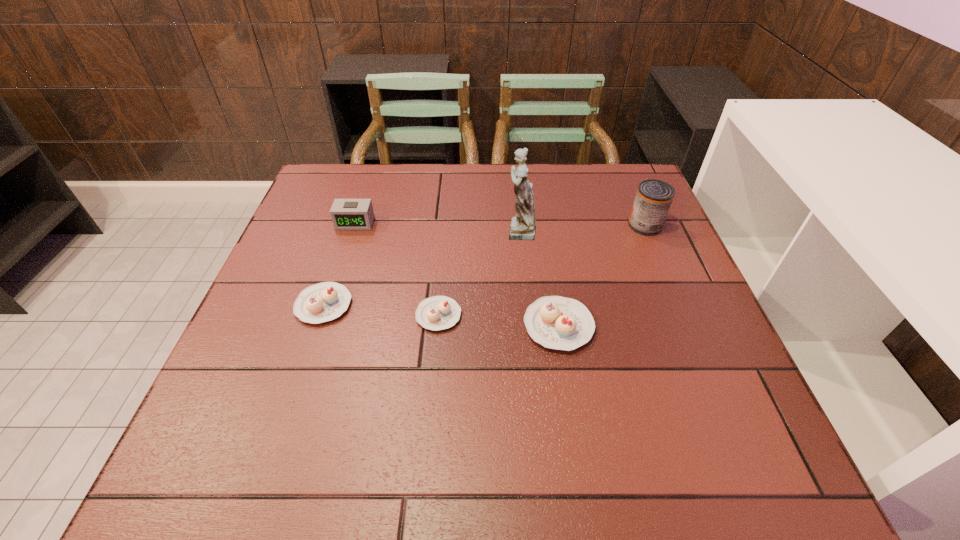
Identify which cupcake is located as the third nearest to the fifth shortest object. Please provide its 2D coordinates. Your answer should be formatted as a tuple, i.e. [(x, y)], where the tuple contains the x and y coordinates of a point satisfying the conditions above.

[(326, 301)]

Where is `free point that satisfies the following two spatial constraints: 1. on the front-facing side of the rightmost object; 2. on the right side of the alarm clock`? The image size is (960, 540). free point that satisfies the following two spatial constraints: 1. on the front-facing side of the rightmost object; 2. on the right side of the alarm clock is located at coordinates (354, 225).

Identify the location of vacant point that satisfies the following two spatial constraints: 1. on the back side of the rightmost cupcake; 2. on the front-facing side of the figurine. This screenshot has width=960, height=540. (543, 231).

What are the coordinates of `free space that satisfies the following two spatial constraints: 1. on the front-facing side of the alarm clock; 2. on the left side of the tallest cupcake` in the screenshot? It's located at tap(322, 326).

Locate an element on the screen. The image size is (960, 540). vacant space that satisfies the following two spatial constraints: 1. on the back side of the rightmost object; 2. on the left side of the rightmost cupcake is located at coordinates (542, 225).

This screenshot has height=540, width=960. Identify the location of vacant position in the image that satisfies the following two spatial constraints: 1. on the front-facing side of the alarm clock; 2. on the right side of the tallest cupcake. (322, 326).

Image resolution: width=960 pixels, height=540 pixels. I want to click on vacant space that satisfies the following two spatial constraints: 1. on the front side of the rightmost cupcake; 2. on the right side of the second shortest cupcake, so click(317, 326).

This screenshot has width=960, height=540. In order to click on free region that satisfies the following two spatial constraints: 1. on the front side of the second shortest object; 2. on the left side of the second cupcake from left to right in this screenshot , I will do `click(321, 315)`.